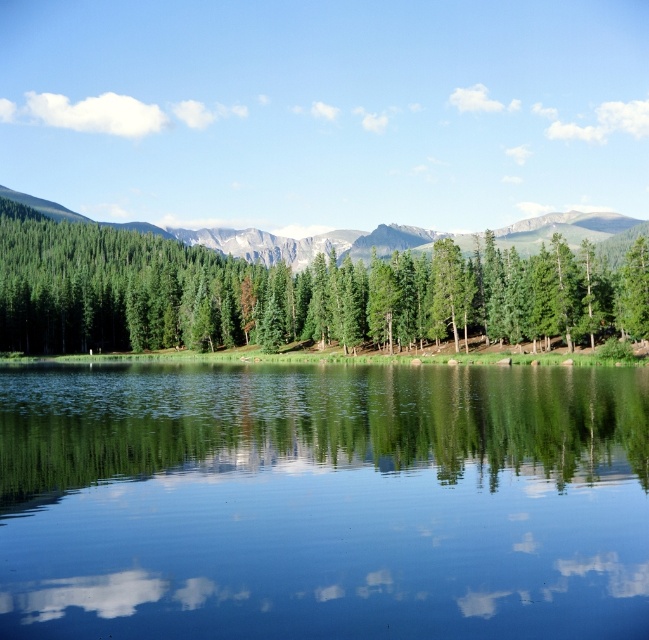
Can you confirm if green glossy water at center is smaller than green matte tree at center?

Yes.

Does green glossy water at center have a greater width compared to green matte tree at center?

In fact, green glossy water at center might be narrower than green matte tree at center.

Describe the element at coordinates (323, 500) in the screenshot. I see `green glossy water at center` at that location.

Image resolution: width=649 pixels, height=640 pixels. I want to click on green glossy water at center, so click(x=323, y=500).

Between green glossy water at center and green forested mountain at center, which one has less height?

With less height is green glossy water at center.

Is point (271, 449) closer to viewer compared to point (239, 241)?

Yes, it is.

Which is behind, point (565, 396) or point (496, 230)?

Point (496, 230)

In order to click on green glossy water at center in this screenshot , I will do `click(323, 500)`.

Between green matte tree at center and green forested mountain at center, which one has more height?

Standing taller between the two is green forested mountain at center.

Who is shorter, green matte tree at center or green forested mountain at center?

green matte tree at center is shorter.

Does point (42, 294) lie behind point (380, 225)?

No, it is in front of (380, 225).

Locate an element on the screen. The height and width of the screenshot is (640, 649). green matte tree at center is located at coordinates (288, 292).